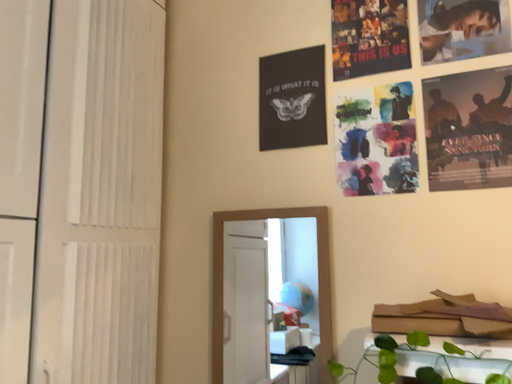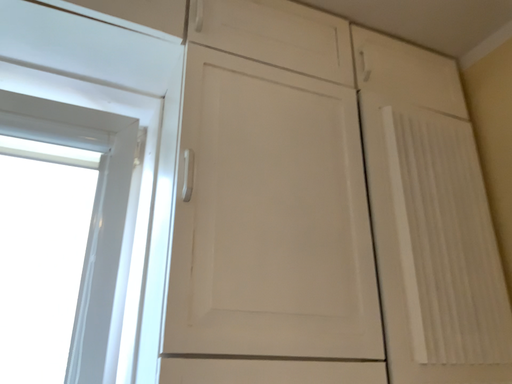
Question: Which way did the camera rotate in the video?

Choices:
 (A) rotated upward
 (B) rotated downward

Answer: (A)